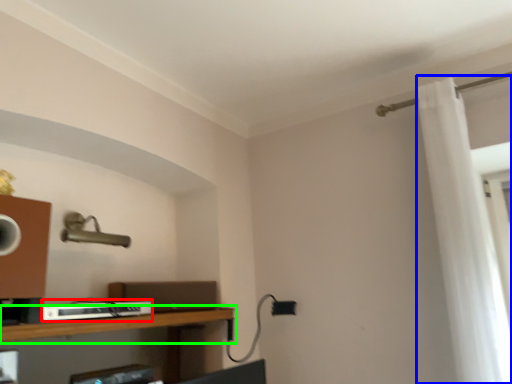
Question: Which object is positioned closest to equipment (highlighted by a red box)? Select from shower curtain (highlighted by a blue box) and shelf (highlighted by a green box).

Choices:
 (A) shower curtain
 (B) shelf

Answer: (B)